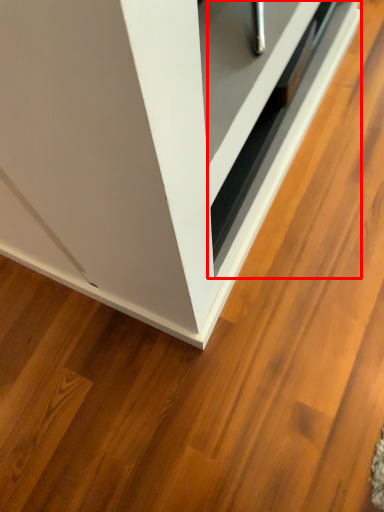
Question: From the image's perspective, where is drawer (annotated by the red box) located in relation to cabinetry in the image?

Choices:
 (A) above
 (B) below

Answer: (A)